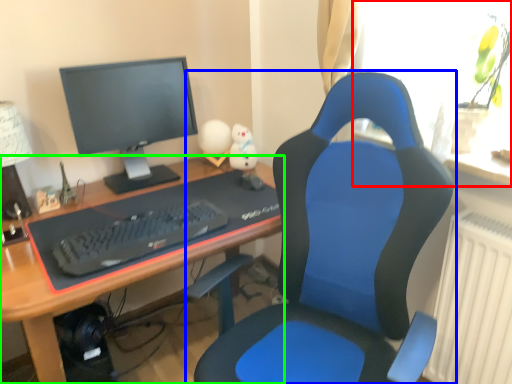
Question: Which object is positioned farthest from window (highlighted by a red box)? Select from chair (highlighted by a blue box) and desk (highlighted by a green box).

Choices:
 (A) chair
 (B) desk

Answer: (B)